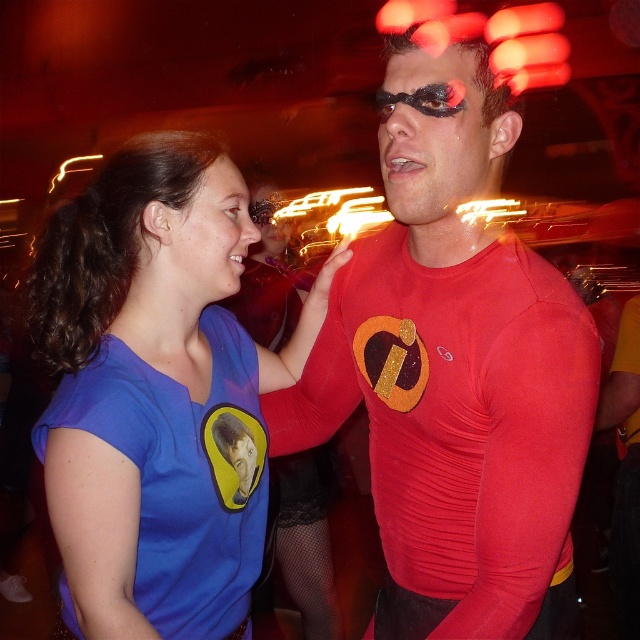
Between point (172, 253) and point (385, 116), which one is positioned behind?

The point (172, 253) is more distant.

Does blue fabric shirt at left appear on the left side of matte red mask at center?

Correct, you'll find blue fabric shirt at left to the left of matte red mask at center.

Which is in front, point (124, 186) or point (381, 106)?

Point (381, 106)

Find the location of a particular element. The image size is (640, 640). blue fabric shirt at left is located at coordinates (156, 392).

Who is positioned more to the left, matte red mask at center or matte blue shirt at left?

matte blue shirt at left is more to the left.

The image size is (640, 640). Identify the location of matte red mask at center. (435, 138).

Is point (432, 145) positioned in front of point (241, 262)?

Yes, it is in front of point (241, 262).

Locate an element on the screen. Image resolution: width=640 pixels, height=640 pixels. matte red mask at center is located at coordinates (435, 138).

Who is shorter, red spandex shirt at center or matte blue shirt at left?

Standing shorter between the two is matte blue shirt at left.

This screenshot has width=640, height=640. I want to click on red spandex shirt at center, so click(454, 372).

At what (x,y) coordinates should I click in order to perform the action: click on red spandex shirt at center. Please return your answer as a coordinate pair (x, y). The height and width of the screenshot is (640, 640). Looking at the image, I should click on (454, 372).